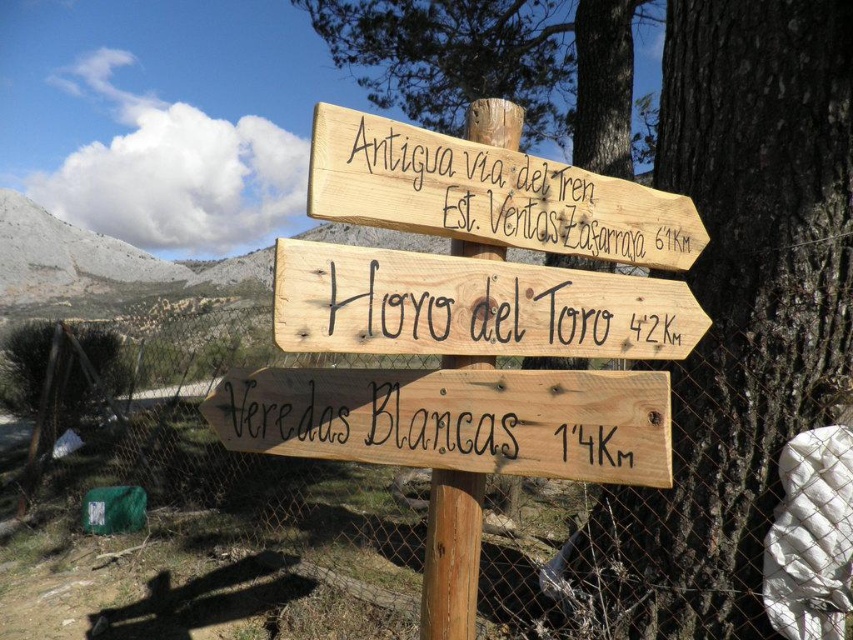
You are a hiker trying to read the natural wood sign at center mounted on the natural wood signpost at center. Can you easily read the sign if you stand directly in front of the signpost?

The natural wood signpost at center is wider than the natural wood sign at center, so the signpost might block part of the sign, making it harder to read clearly from directly in front.

You are standing at the base of the wooden signpost with three directional signs. You want to know how far you are from the point marked as point (250, 385). Can you determine the distance?

You are 6.60 feet away from the point marked as point (250, 385).

Consider the image. You are standing in front of the wooden signpost with three directional signs. There are two points marked on the signpost. One is at coordinate point (502, 68) and the other at point (595, 273). Which of these two points is closer to you?

Point (502, 68) is further to the camera than point (595, 273), so the point closer to you is point (595, 273).